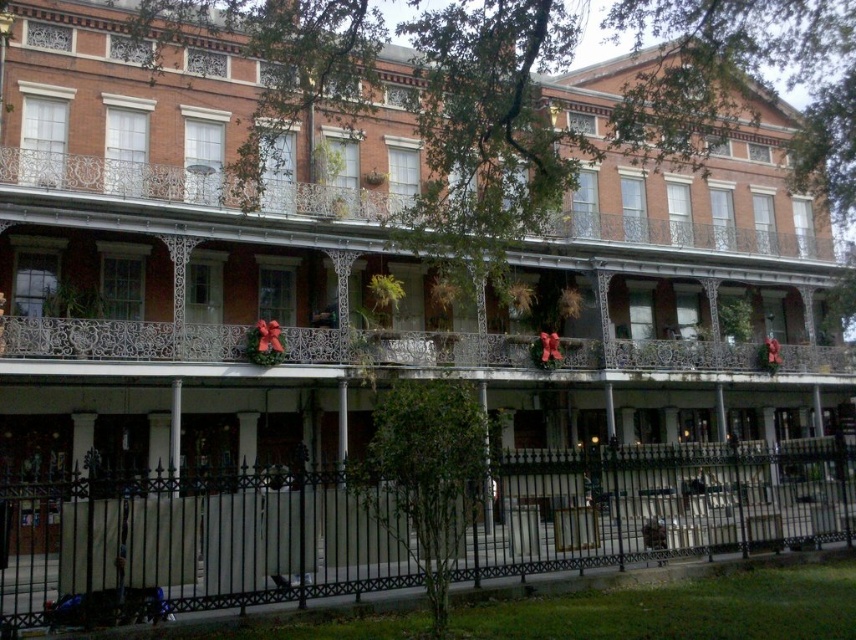
You are standing in front of a historic building with ornate balconies. You notice two points marked on the building facade. The first point is at coordinate point (539, 490) and the second is at point (792, 369). From your vantage point, which point appears closer to you?

Point (539, 490) is in front of point (792, 369), so it appears closer to you.